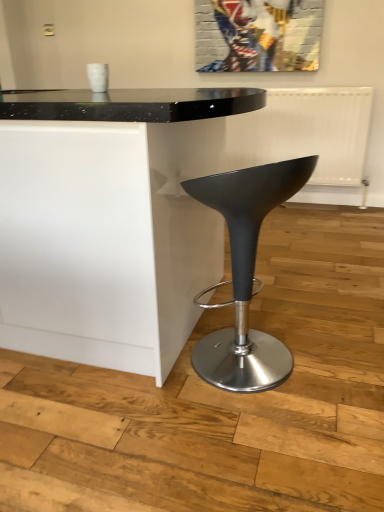
Question: Should I look upward or downward to see matte black stool at center?

Choices:
 (A) up
 (B) down

Answer: (B)